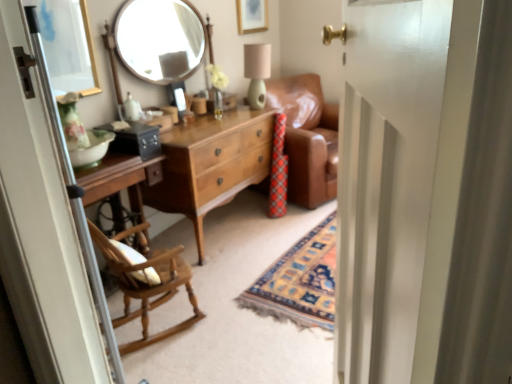
I want to click on free spot in front of matte green lampshade at upper center, so click(x=250, y=113).